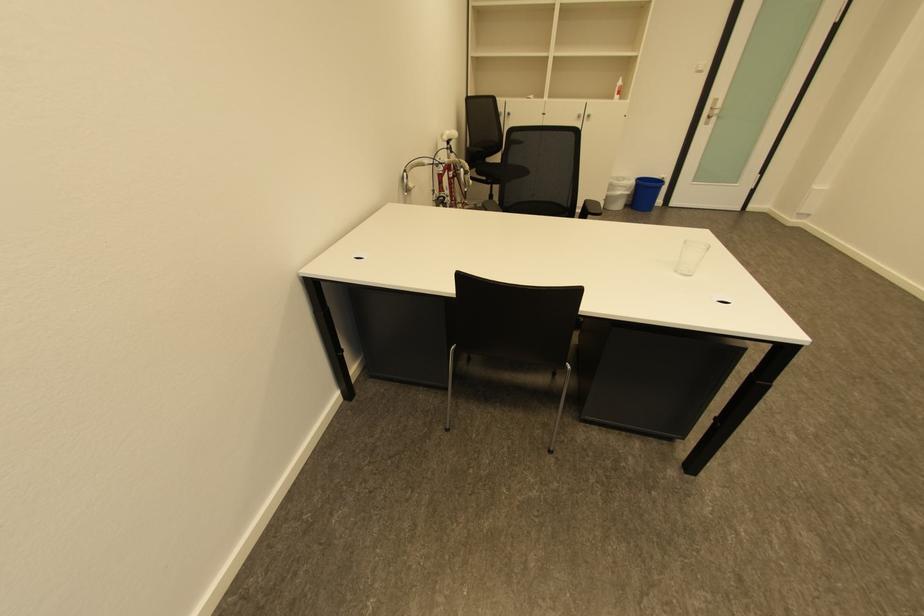
Find where to sit the white bicycle seat. Please return your answer as a coordinate pair (x, y).

(448, 136)